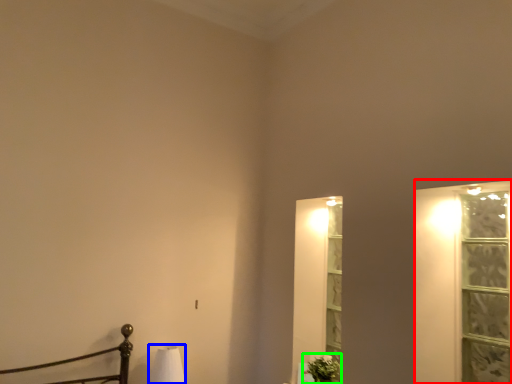
Question: Which is farther away from window frame (highlighted by a red box)? table lamp (highlighted by a blue box) or plant (highlighted by a green box)?

Choices:
 (A) table lamp
 (B) plant

Answer: (A)